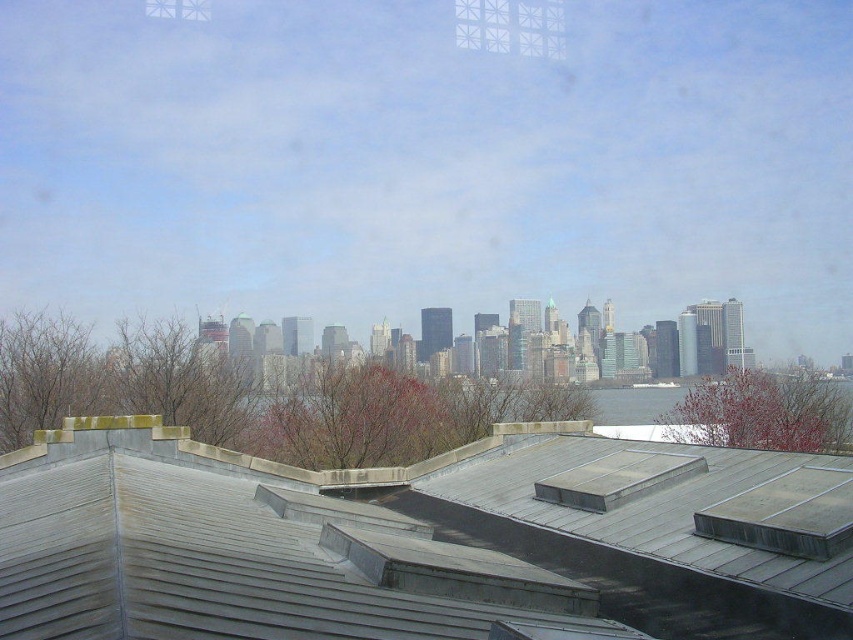
You are an architect analyzing the city skyline. You notice the gray metal roof at center and the white textured window at upper center. Which object is located lower in the scene?

The gray metal roof at center is positioned under the white textured window at upper center, so it is located lower in the scene.

You are an architect evaluating the city skyline. You notice the gray metal roof at center and the white textured window at upper center. Which of these two elements has a larger area in the image?

The white textured window at upper center has a larger area than the gray metal roof at center, as the gray metal roof at center is described as having a smaller size compared to the white textured window at upper center.